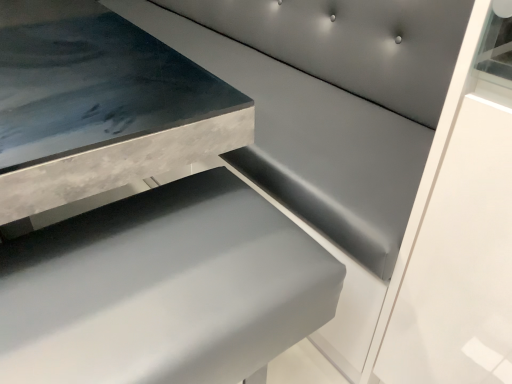
Identify the location of matte gray cushion at lower left. The width and height of the screenshot is (512, 384). (163, 289).

This screenshot has width=512, height=384. Describe the element at coordinates (163, 289) in the screenshot. I see `matte gray cushion at lower left` at that location.

Where is `matte gray cushion at lower left`? matte gray cushion at lower left is located at coordinates (163, 289).